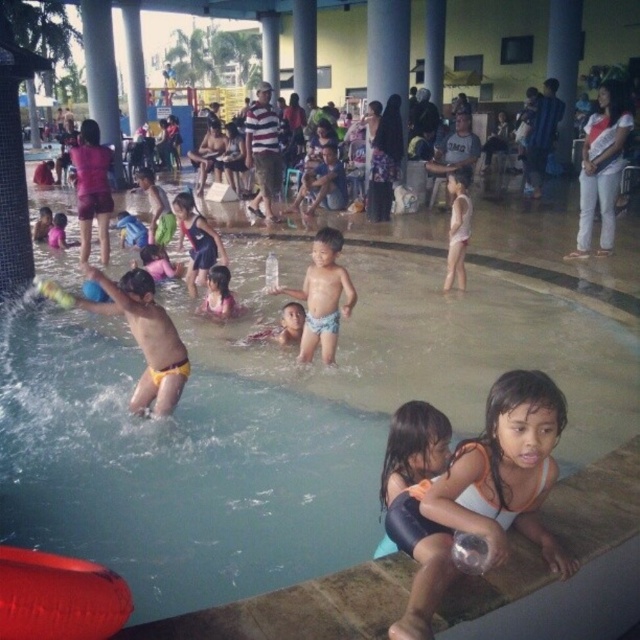
Can you confirm if matte pink swimsuit at center is thinner than smooth skin child at center?

Yes.

Who is positioned more to the right, matte pink swimsuit at center or smooth skin child at center?

Positioned to the right is smooth skin child at center.

You are a GUI agent. You are given a task and a screenshot of the screen. Output one action in this format:
    pyautogui.click(x=<x>, y=<y>)
    Task: Click on the matte pink swimsuit at center
    This screenshot has height=640, width=640.
    Given the screenshot: What is the action you would take?
    pyautogui.click(x=218, y=292)

Who is higher up, white matte swimsuit at lower right or smooth skin child at center?

smooth skin child at center

Can you confirm if white matte swimsuit at lower right is smaller than smooth skin child at center?

No.

What are the coordinates of `white matte swimsuit at lower right` in the screenshot? It's located at point(483,492).

I want to click on white matte swimsuit at lower right, so click(483, 492).

What do you see at coordinates (483, 492) in the screenshot? I see `white matte swimsuit at lower right` at bounding box center [483, 492].

Between white matte swimsuit at lower right and matte pink shirt at upper left, which one has more height?

white matte swimsuit at lower right

Who is more distant from viewer, [461,490] or [77,196]?

The point [77,196] is more distant.

What are the coordinates of `white matte swimsuit at lower right` in the screenshot? It's located at (483, 492).